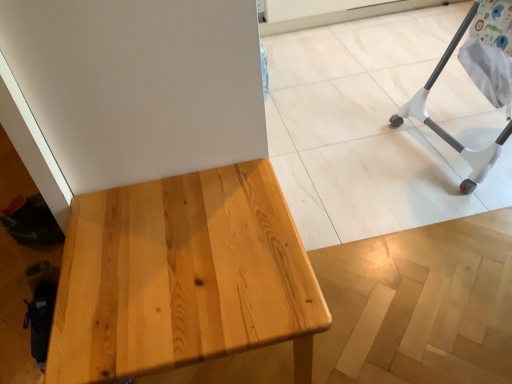
Question: Is natural wood table at center further to the viewer compared to white plastic baby bouncer at right?

Choices:
 (A) yes
 (B) no

Answer: (B)

Question: Would you say natural wood table at center is a long distance from white plastic baby bouncer at right?

Choices:
 (A) no
 (B) yes

Answer: (B)

Question: Considering the relative positions of natural wood table at center and white plastic baby bouncer at right in the image provided, is natural wood table at center to the right of white plastic baby bouncer at right from the viewer's perspective?

Choices:
 (A) no
 (B) yes

Answer: (A)

Question: Considering the relative sizes of natural wood table at center and white plastic baby bouncer at right in the image provided, is natural wood table at center shorter than white plastic baby bouncer at right?

Choices:
 (A) no
 (B) yes

Answer: (B)

Question: Can you confirm if natural wood table at center is positioned to the left of white plastic baby bouncer at right?

Choices:
 (A) yes
 (B) no

Answer: (A)

Question: Could you tell me if natural wood table at center is facing white plastic baby bouncer at right?

Choices:
 (A) yes
 (B) no

Answer: (B)

Question: Is white plastic baby bouncer at right positioned before natural wood table at center?

Choices:
 (A) no
 (B) yes

Answer: (A)

Question: Would you say natural wood table at center is part of white plastic baby bouncer at right's contents?

Choices:
 (A) no
 (B) yes

Answer: (A)

Question: Is white plastic baby bouncer at right at the left side of natural wood table at center?

Choices:
 (A) no
 (B) yes

Answer: (A)

Question: Can you confirm if white plastic baby bouncer at right is wider than natural wood table at center?

Choices:
 (A) yes
 (B) no

Answer: (A)

Question: Is white plastic baby bouncer at right looking in the opposite direction of natural wood table at center?

Choices:
 (A) no
 (B) yes

Answer: (A)

Question: Does white plastic baby bouncer at right have a greater height compared to natural wood table at center?

Choices:
 (A) no
 (B) yes

Answer: (B)

Question: From a real-world perspective, is natural wood table at center positioned above or below white plastic baby bouncer at right?

Choices:
 (A) above
 (B) below

Answer: (B)